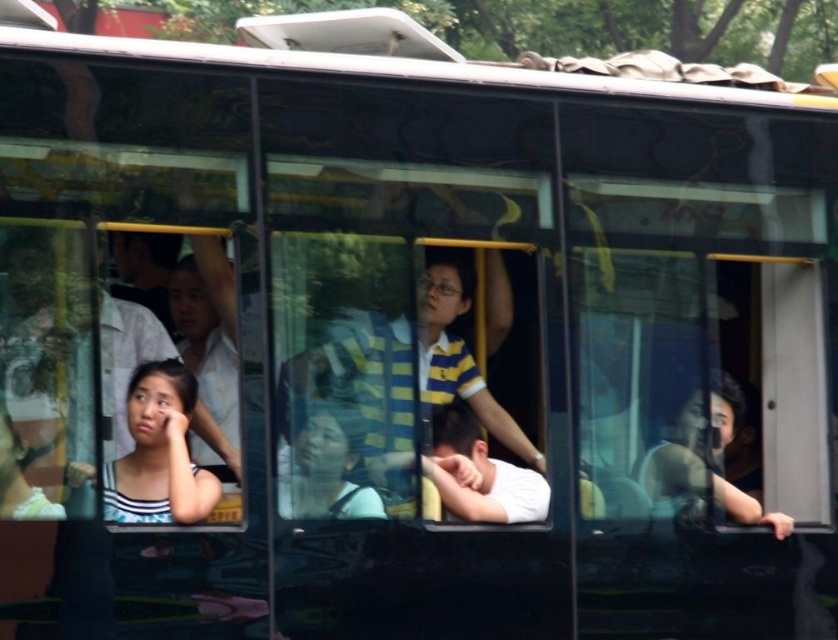
How distant is yellow striped shirt at center from striped fabric face at lower left?

yellow striped shirt at center is 19.77 inches from striped fabric face at lower left.

Is yellow striped shirt at center below striped fabric face at lower left?

No, yellow striped shirt at center is not below striped fabric face at lower left.

Between point (355, 481) and point (166, 502), which one is positioned in front?

Point (166, 502) is in front.

Identify the location of yellow striped shirt at center. (401, 419).